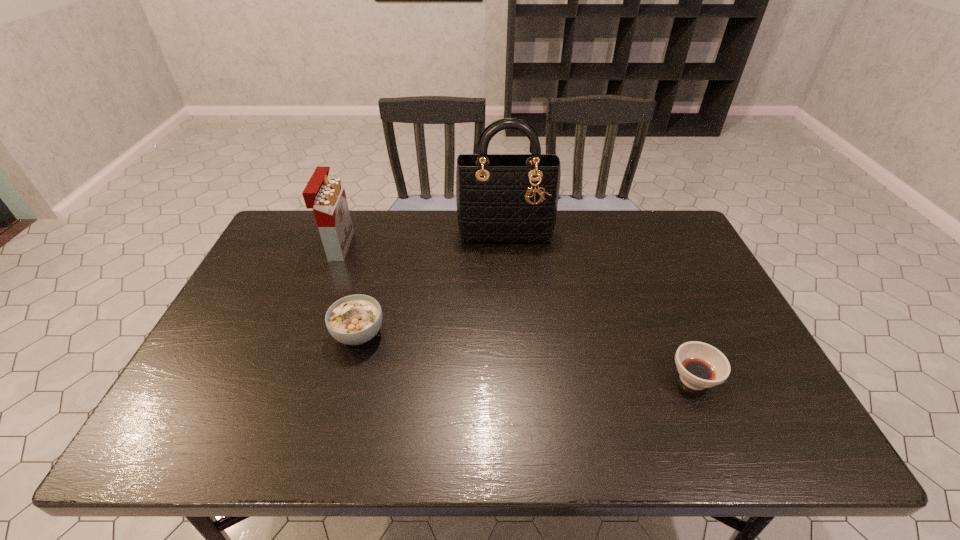
At what (x,y) coordinates should I click in order to perform the action: click on free spot that satisfies the following two spatial constraints: 1. with the lid open on the second tallest object; 2. on the back side of the nearest object. Please return your answer as a coordinate pair (x, y). Image resolution: width=960 pixels, height=540 pixels. Looking at the image, I should click on (288, 379).

At what (x,y) coordinates should I click in order to perform the action: click on free spot that satisfies the following two spatial constraints: 1. with the lid open on the cigarette case; 2. on the back side of the left soup bowl. Please return your answer as a coordinate pair (x, y). The width and height of the screenshot is (960, 540). Looking at the image, I should click on (305, 334).

The height and width of the screenshot is (540, 960). I want to click on vacant space that satisfies the following two spatial constraints: 1. with the lid open on the cigarette case; 2. on the left side of the left soup bowl, so click(305, 334).

This screenshot has height=540, width=960. I want to click on vacant area in the image that satisfies the following two spatial constraints: 1. with the lid open on the cigarette case; 2. on the right side of the third farthest object, so click(x=305, y=334).

Find the location of a particular element. This screenshot has height=540, width=960. vacant region that satisfies the following two spatial constraints: 1. at the front of the third object from left to right with visible charms; 2. on the left side of the shorter soup bowl is located at coordinates (516, 379).

Locate an element on the screen. vacant position in the image that satisfies the following two spatial constraints: 1. on the back side of the shortest object; 2. with the lid open on the third shortest object is located at coordinates (636, 246).